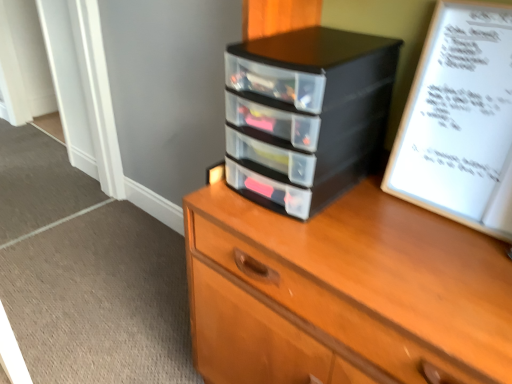
What do you see at coordinates (306, 114) in the screenshot? I see `black plastic drawers at center` at bounding box center [306, 114].

At what (x,y) coordinates should I click in order to perform the action: click on white paper at upper right. Please return your answer as a coordinate pair (x, y). The height and width of the screenshot is (384, 512). Looking at the image, I should click on (460, 121).

Where is `the chest of drawers lying below the white paper at upper right (from the image's perspective)`? the chest of drawers lying below the white paper at upper right (from the image's perspective) is located at coordinates (343, 292).

Between black plastic chest of drawers at center and white paper at upper right, which one appears on the right side from the viewer's perspective?

white paper at upper right.

Which of these two, black plastic chest of drawers at center or white paper at upper right, is thinner?

white paper at upper right.

Is white paper at upper right at the back of black plastic chest of drawers at center?

That's right, black plastic chest of drawers at center is facing away from white paper at upper right.

Is white paper at upper right next to black plastic chest of drawers at center?

No, white paper at upper right is not in contact with black plastic chest of drawers at center.

Is white paper at upper right closer to camera compared to black plastic chest of drawers at center?

No, white paper at upper right is further to the viewer.

From a real-world perspective, which object stands above the other?

In real-world perspective, white paper at upper right is above.

Considering the sizes of objects white paper at upper right and black plastic chest of drawers at center in the image provided, who is taller, white paper at upper right or black plastic chest of drawers at center?

black plastic chest of drawers at center is taller.

Is black plastic drawers at center turned away from white paper at upper right?

No, black plastic drawers at center is not facing the opposite direction of white paper at upper right.

Is black plastic drawers at center in contact with white paper at upper right?

No, black plastic drawers at center is not next to white paper at upper right.

Would you say black plastic drawers at center is outside white paper at upper right?

Yes, black plastic drawers at center is located beyond the bounds of white paper at upper right.

Find the location of a particular element. The width and height of the screenshot is (512, 384). nightstand above the white paper at upper right (from the image's perspective) is located at coordinates (306, 114).

Would you consider white paper at upper right to be distant from black plastic drawers at center?

No, white paper at upper right is not far away from black plastic drawers at center.

From the image's perspective, is white paper at upper right located above black plastic drawers at center?

No, from the image's perspective, white paper at upper right is not on top of black plastic drawers at center.

From a real-world perspective, which is physically below, white paper at upper right or black plastic drawers at center?

In real-world perspective, black plastic drawers at center is lower.

Is black plastic chest of drawers at center not within black plastic drawers at center?

Absolutely, black plastic chest of drawers at center is external to black plastic drawers at center.

Can you confirm if black plastic chest of drawers at center is thinner than black plastic drawers at center?

No, black plastic chest of drawers at center is not thinner than black plastic drawers at center.

Which is more to the left, black plastic chest of drawers at center or black plastic drawers at center?

From the viewer's perspective, black plastic drawers at center appears more on the left side.

Considering the sizes of objects black plastic chest of drawers at center and black plastic drawers at center in the image provided, who is taller, black plastic chest of drawers at center or black plastic drawers at center?

Standing taller between the two is black plastic chest of drawers at center.

Is black plastic chest of drawers at center a part of black plastic drawers at center?

That's incorrect, black plastic chest of drawers at center is not inside black plastic drawers at center.

Considering the relative sizes of black plastic drawers at center and black plastic chest of drawers at center in the image provided, is black plastic drawers at center smaller than black plastic chest of drawers at center?

Correct, black plastic drawers at center occupies less space than black plastic chest of drawers at center.

Considering the relative positions of black plastic drawers at center and black plastic chest of drawers at center in the image provided, is black plastic drawers at center to the left of black plastic chest of drawers at center from the viewer's perspective?

Indeed, black plastic drawers at center is positioned on the left side of black plastic chest of drawers at center.

From the image's perspective, is black plastic drawers at center beneath black plastic chest of drawers at center?

Actually, black plastic drawers at center appears above black plastic chest of drawers at center in the image.

At what (x,y) coordinates should I click in order to perform the action: click on chest of drawers on the left of white paper at upper right. Please return your answer as a coordinate pair (x, y). The image size is (512, 384). Looking at the image, I should click on (343, 292).

This screenshot has width=512, height=384. In order to click on chest of drawers below the white paper at upper right (from the image's perspective) in this screenshot , I will do `click(343, 292)`.

Looking at this image, estimate the real-world distances between objects in this image. Which object is closer to white paper at upper right, black plastic chest of drawers at center or black plastic drawers at center?

Among the two, black plastic drawers at center is located nearer to white paper at upper right.

Considering their positions, is black plastic drawers at center positioned closer to white paper at upper right than black plastic chest of drawers at center?

black plastic drawers at center lies closer to white paper at upper right than the other object.

When comparing their distances from black plastic drawers at center, does white paper at upper right or black plastic chest of drawers at center seem further?

Based on the image, black plastic chest of drawers at center appears to be further to black plastic drawers at center.

Considering their positions, is black plastic drawers at center positioned further to black plastic chest of drawers at center than white paper at upper right?

The object further to black plastic chest of drawers at center is white paper at upper right.

When comparing their distances from black plastic drawers at center, does black plastic chest of drawers at center or white paper at upper right seem closer?

Based on the image, white paper at upper right appears to be nearer to black plastic drawers at center.

Estimate the real-world distances between objects in this image. Which object is closer to black plastic chest of drawers at center, white paper at upper right or black plastic drawers at center?

black plastic drawers at center is closer to black plastic chest of drawers at center.

Identify the location of paperback book between black plastic drawers at center and black plastic chest of drawers at center from top to bottom. The height and width of the screenshot is (384, 512). (460, 121).